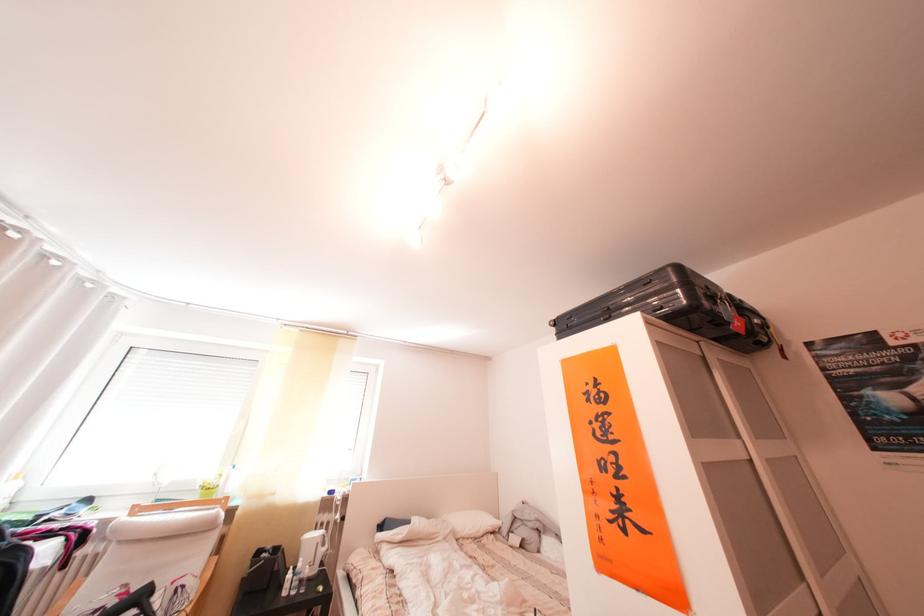
Find where to lift the black suitcase. Please return your answer as a coordinate pair (x, y).

(659, 304)